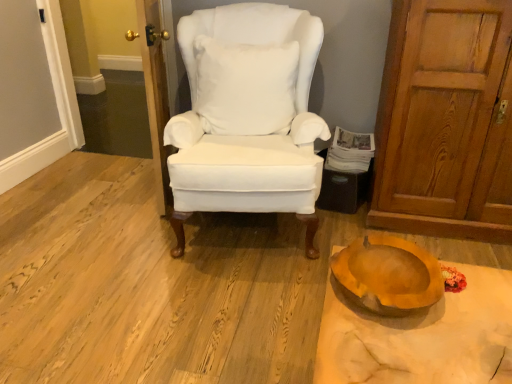
Find the location of a particular element. free space above wooden bowl at lower right (from a real-world perspective) is located at coordinates (432, 317).